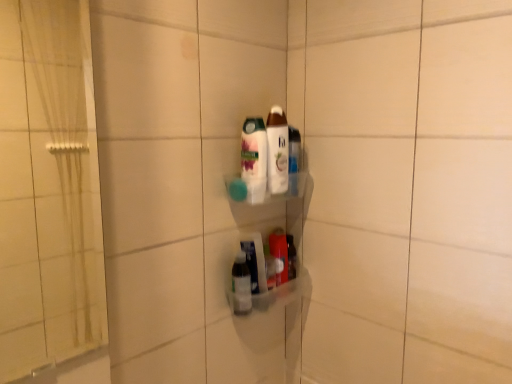
Question: Could translucent plastic bottle at lower center, which appears as the 2th bottle when ordered from the bottom, be considered to be inside white glossy bottle at center, positioned as the third bottle in bottom-to-top order?

Choices:
 (A) no
 (B) yes

Answer: (A)

Question: Is white glossy bottle at center, positioned as the third bottle in bottom-to-top order, bigger than translucent plastic bottle at lower center, the 3th bottle in the top-to-bottom sequence?

Choices:
 (A) yes
 (B) no

Answer: (A)

Question: Considering the relative sizes of white glossy bottle at center, arranged as the second bottle when viewed from the top, and translucent plastic bottle at lower center, which appears as the 2th bottle when ordered from the bottom, in the image provided, is white glossy bottle at center, arranged as the second bottle when viewed from the top, wider than translucent plastic bottle at lower center, which appears as the 2th bottle when ordered from the bottom,?

Choices:
 (A) no
 (B) yes

Answer: (B)

Question: From the image's perspective, is white glossy bottle at center, positioned as the third bottle in bottom-to-top order, above translucent plastic bottle at lower center, the 3th bottle in the top-to-bottom sequence?

Choices:
 (A) no
 (B) yes

Answer: (B)

Question: Is white glossy bottle at center, positioned as the third bottle in bottom-to-top order, completely or partially outside of translucent plastic bottle at lower center, the 3th bottle in the top-to-bottom sequence?

Choices:
 (A) no
 (B) yes

Answer: (B)

Question: From a real-world perspective, is translucent plastic bottle at center, which ranks as the 4th bottle in top-to-bottom order, positioned above or below translucent plastic bottle at lower center, which appears as the 2th bottle when ordered from the bottom?

Choices:
 (A) below
 (B) above

Answer: (A)

Question: Considering the relative positions of translucent plastic bottle at center, which ranks as the 4th bottle in top-to-bottom order, and translucent plastic bottle at lower center, which appears as the 2th bottle when ordered from the bottom, in the image provided, is translucent plastic bottle at center, which ranks as the 4th bottle in top-to-bottom order, to the left or to the right of translucent plastic bottle at lower center, which appears as the 2th bottle when ordered from the bottom,?

Choices:
 (A) right
 (B) left

Answer: (B)

Question: Do you think translucent plastic bottle at center, the first bottle in the bottom-to-top sequence, is within translucent plastic bottle at lower center, which appears as the 2th bottle when ordered from the bottom, or outside of it?

Choices:
 (A) outside
 (B) inside

Answer: (A)

Question: Is translucent plastic bottle at center, the first bottle in the bottom-to-top sequence, in front of or behind translucent plastic bottle at lower center, the 3th bottle in the top-to-bottom sequence, in the image?

Choices:
 (A) behind
 (B) front

Answer: (B)

Question: In the image, is translucent plastic bottle at center, the first bottle in the bottom-to-top sequence, positioned in front of or behind white glossy bottle at center, positioned as the third bottle in bottom-to-top order?

Choices:
 (A) behind
 (B) front

Answer: (A)

Question: From a real-world perspective, relative to white glossy bottle at center, arranged as the second bottle when viewed from the top, is translucent plastic bottle at center, which ranks as the 4th bottle in top-to-bottom order, vertically above or below?

Choices:
 (A) below
 (B) above

Answer: (A)

Question: From their relative heights in the image, would you say translucent plastic bottle at center, the first bottle in the bottom-to-top sequence, is taller or shorter than white glossy bottle at center, positioned as the third bottle in bottom-to-top order?

Choices:
 (A) short
 (B) tall

Answer: (A)

Question: Is translucent plastic bottle at center, the first bottle in the bottom-to-top sequence, wider or thinner than white glossy bottle at center, positioned as the third bottle in bottom-to-top order?

Choices:
 (A) thin
 (B) wide

Answer: (A)

Question: Is point (267, 114) positioned closer to the camera than point (263, 188)?

Choices:
 (A) closer
 (B) farther

Answer: (B)

Question: Is white glossy lotion at center, arranged as the 1th bottle when viewed from the top, taller or shorter than white glossy bottle at center, arranged as the second bottle when viewed from the top?

Choices:
 (A) tall
 (B) short

Answer: (A)